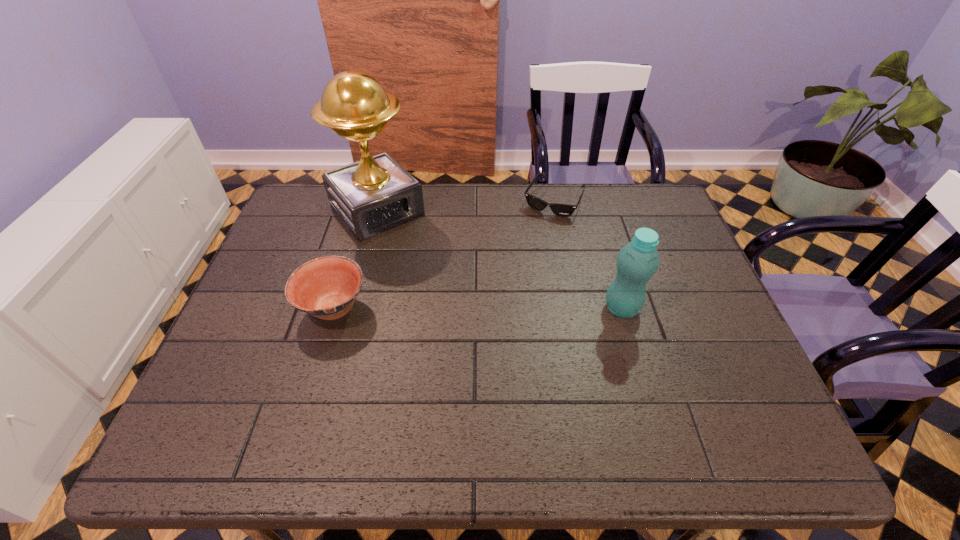
Where is `vacant spot on the desktop that is between the bowl and the water bottle and is positioned on the front-facing side of the shortest object`? The height and width of the screenshot is (540, 960). vacant spot on the desktop that is between the bowl and the water bottle and is positioned on the front-facing side of the shortest object is located at coordinates (492, 308).

Find the location of a particular element. The image size is (960, 540). free space on the desktop that is between the second shortest object and the second tallest object and is positioned on the front-facing side of the tallest object is located at coordinates (466, 308).